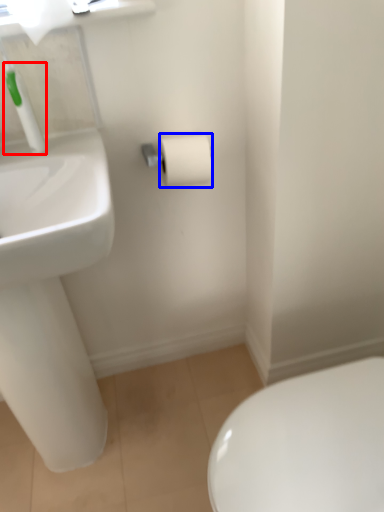
Question: Which object is further to the camera taking this photo, plumbing fixture (highlighted by a red box) or toilet paper (highlighted by a blue box)?

Choices:
 (A) plumbing fixture
 (B) toilet paper

Answer: (B)